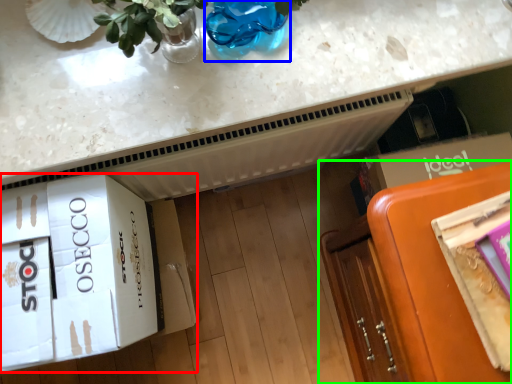
Question: Which object is the farthest from cardboard box (highlighted by a red box)? Choose among these: glass vase (highlighted by a blue box) or furniture (highlighted by a green box).

Choices:
 (A) glass vase
 (B) furniture

Answer: (B)